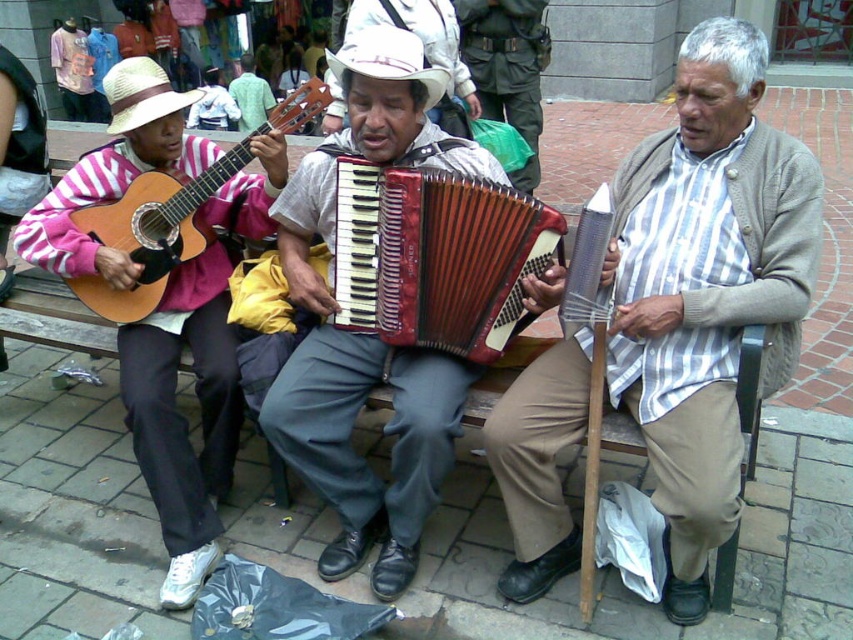
Question: Which object appears farthest from the camera in this image?

Choices:
 (A) striped cotton shirt at center
 (B) matte wood guitar at left

Answer: (B)

Question: Can you confirm if striped cotton shirt at center is positioned to the right of matte red accordion at center?

Choices:
 (A) yes
 (B) no

Answer: (A)

Question: Is matte pink sweater at left below green fabric bag at center?

Choices:
 (A) no
 (B) yes

Answer: (B)

Question: Which point is farther to the camera?

Choices:
 (A) striped cotton shirt at center
 (B) green fabric bag at center
 (C) matte wood guitar at left

Answer: (B)

Question: Does matte red accordion at center appear on the right side of green fabric bag at center?

Choices:
 (A) no
 (B) yes

Answer: (A)

Question: Which of the following is the closest to the observer?

Choices:
 (A) striped cotton shirt at center
 (B) matte pink sweater at left

Answer: (A)